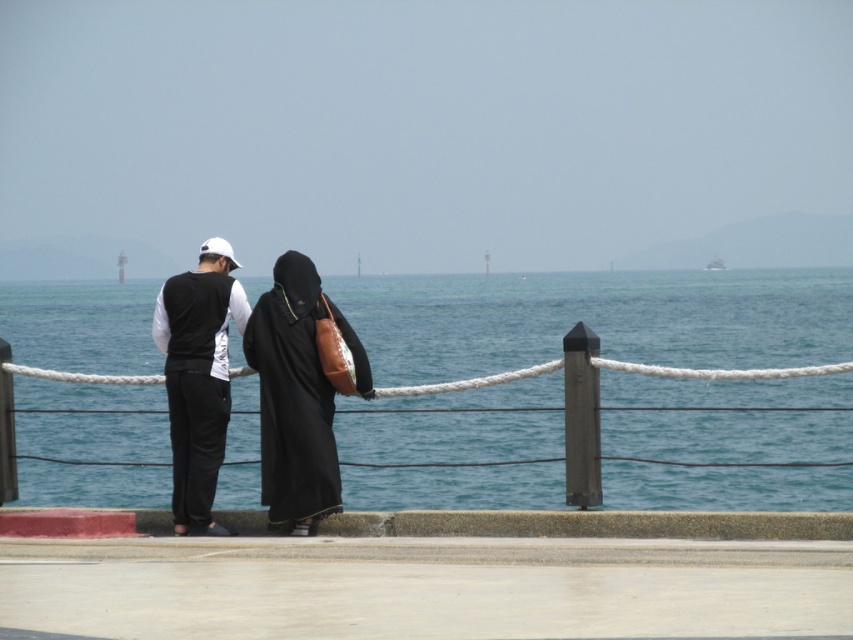
You are standing on the concrete platform and want to throw a frisbee to your friend who is standing 12 meters away from you. Can you reach your friend by throwing the frisbee from the blue water at center?

The blue water at center is 10.74 meters away from the viewer. Since your friend is 12 meters away, which is farther than the distance to the blue water, you cannot reach them by throwing the frisbee from the blue water at center.

You are a photographer trying to capture a shot of the blue water at center and the black matte dress at center. Based on their positions, which one would appear closer to the camera in the photo?

The blue water at center appears closer to the camera because it is positioned above the black matte dress at center, making it visually nearer in the frame.

You are a photographer positioned on the platform. You want to capture a photo of the blue water at center without the black matte dress at center appearing in the foreground. Is this possible based on their positions?

The blue water at center is in front of the black matte dress at center, so the dress would block the view of the water. Therefore, it is not possible to capture the blue water at center without the black matte dress at center appearing in the foreground.